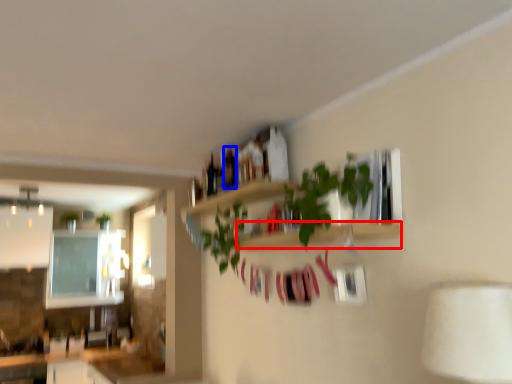
Question: Among these objects, which one is farthest to the camera, shelf (highlighted by a red box) or bottle (highlighted by a blue box)?

Choices:
 (A) shelf
 (B) bottle

Answer: (B)